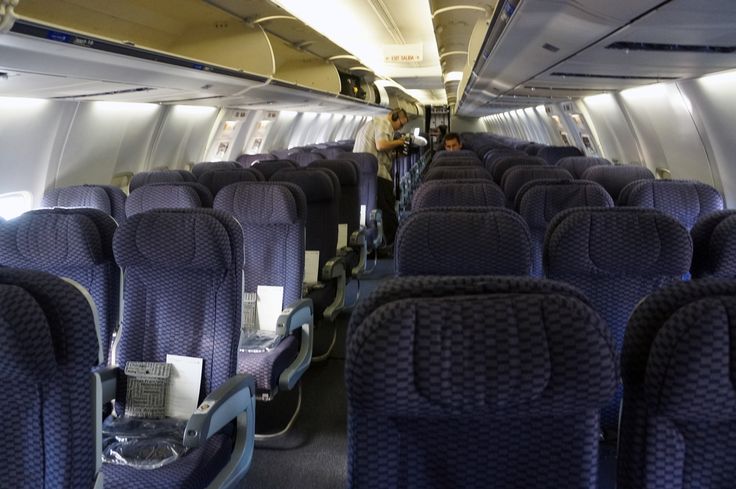
I want to click on over head storage, so click(x=82, y=27), click(x=290, y=49), click(x=346, y=78), click(x=375, y=89), click(x=484, y=23), click(x=464, y=70), click(x=456, y=94).